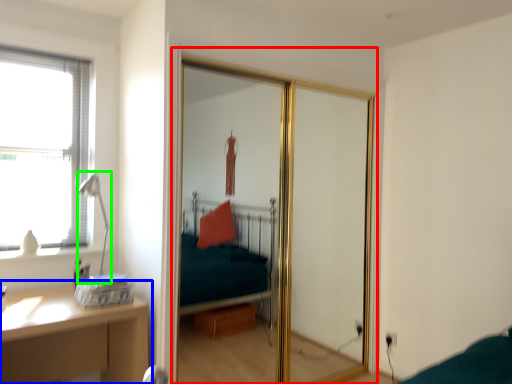
Question: Estimate the real-world distances between objects in this image. Which object is farther from screen door (highlighted by a red box), table (highlighted by a blue box) or table lamp (highlighted by a green box)?

Choices:
 (A) table
 (B) table lamp

Answer: (B)